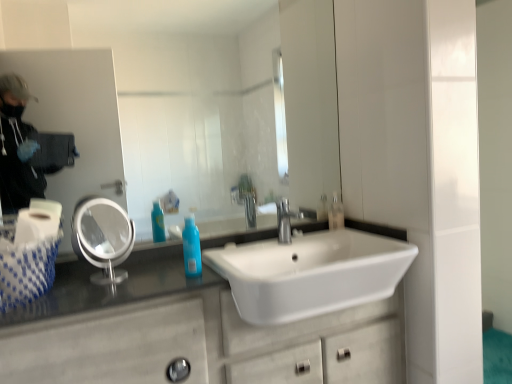
Question: Is white glossy mirror at upper center, the first mirror in the right-to-left sequence, wider or thinner than white woven tissue at left?

Choices:
 (A) thin
 (B) wide

Answer: (A)

Question: In the image, is white glossy mirror at upper center, the first mirror in the right-to-left sequence, on the left side or the right side of white woven tissue at left?

Choices:
 (A) left
 (B) right

Answer: (B)

Question: Estimate the real-world distances between objects in this image. Which object is farther from the blue glossy bottle at center?

Choices:
 (A) clear plastic mirror at left, the first mirror from the left
 (B) white glossy mirror at upper center, the first mirror in the right-to-left sequence
 (C) white woven tissue at left
 (D) white marble bathroom cabinet at lower left
 (E) translucent plastic soap dispenser at upper right

Answer: (B)

Question: Which object is the farthest from the blue glossy bottle at center?

Choices:
 (A) white glossy sink at center
 (B) white glossy mirror at upper center, the first mirror in the right-to-left sequence
 (C) white marble bathroom cabinet at lower left
 (D) white woven tissue at left
 (E) silver metallic faucet at center

Answer: (B)